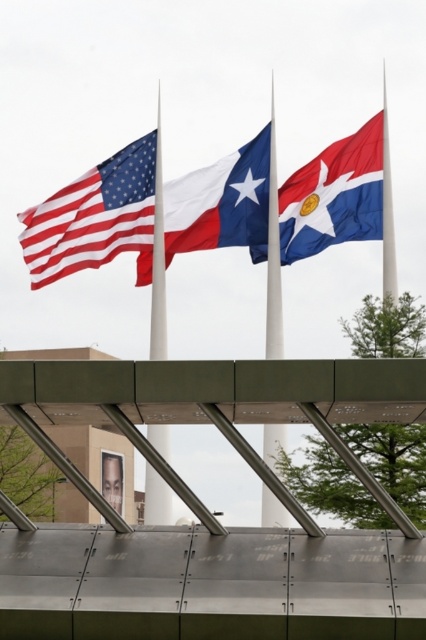
You are standing in front of three flags mounted on poles. You see the matte fabric american flag at left. Which flag is positioned to the left of the Texas state flag?

The matte fabric american flag at left is positioned to the left of the Texas state flag.

You are a photographer trying to capture the matte fabric american flag at left and the blue and white fabric flag at upper right in a single shot. Do you need to adjust your camera angle to ensure both flags are visible in the frame?

The blue and white fabric flag at upper right is behind the matte fabric american flag at left, so you need to adjust your camera angle to ensure both flags are visible in the frame.